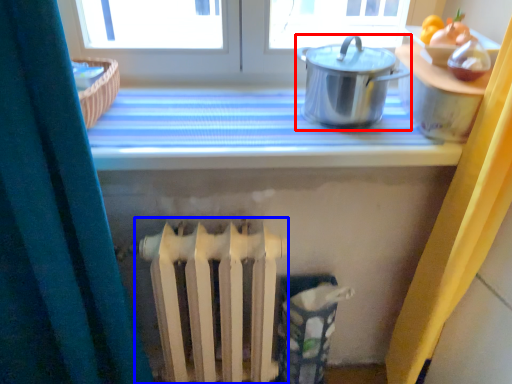
Question: Which point is further to the camera, kitchen appliance (highlighted by a red box) or radiator (highlighted by a blue box)?

Choices:
 (A) kitchen appliance
 (B) radiator

Answer: (B)